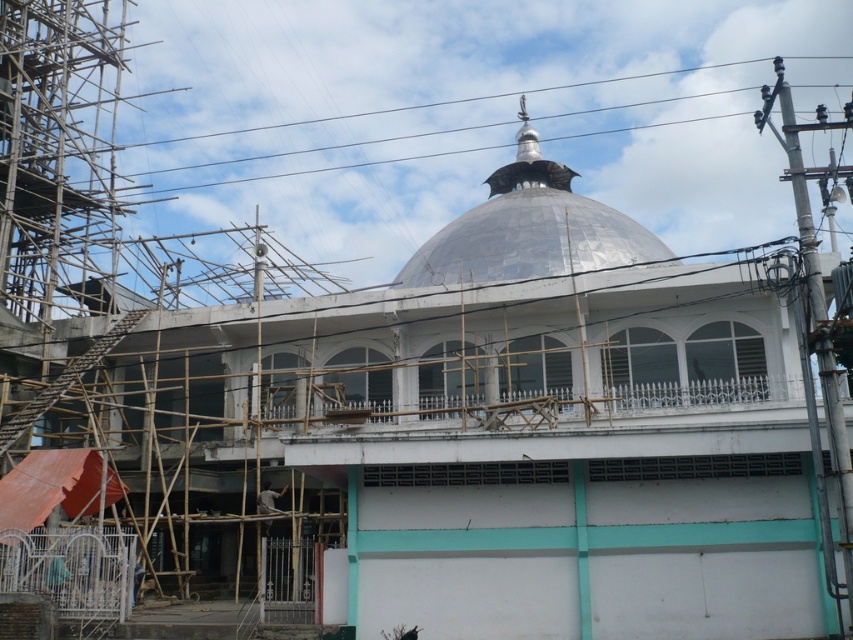
In the scene shown: Does shiny metallic dome at center have a lesser height compared to metallic wire at upper center?

Correct, shiny metallic dome at center is not as tall as metallic wire at upper center.

Who is shorter, shiny metallic dome at center or metallic wire at upper center?

shiny metallic dome at center

Is point (437, 259) positioned after point (402, 106)?

No, it is not.

In order to click on shiny metallic dome at center in this screenshot , I will do [531, 228].

Which is behind, point (666, 100) or point (282, 486)?

Positioned behind is point (666, 100).

What do you see at coordinates (318, 120) in the screenshot? Image resolution: width=853 pixels, height=640 pixels. I see `metallic wire at upper center` at bounding box center [318, 120].

Where is `metallic wire at upper center`? This screenshot has width=853, height=640. metallic wire at upper center is located at coordinates (318, 120).

Between shiny metallic dome at center and light brown wooden construction worker at lower left, which one appears on the right side from the viewer's perspective?

shiny metallic dome at center

How much distance is there between shiny metallic dome at center and light brown wooden construction worker at lower left?

A distance of 35.85 meters exists between shiny metallic dome at center and light brown wooden construction worker at lower left.

What do you see at coordinates (531, 228) in the screenshot? I see `shiny metallic dome at center` at bounding box center [531, 228].

Where is `shiny metallic dome at center`? The width and height of the screenshot is (853, 640). shiny metallic dome at center is located at coordinates (531, 228).